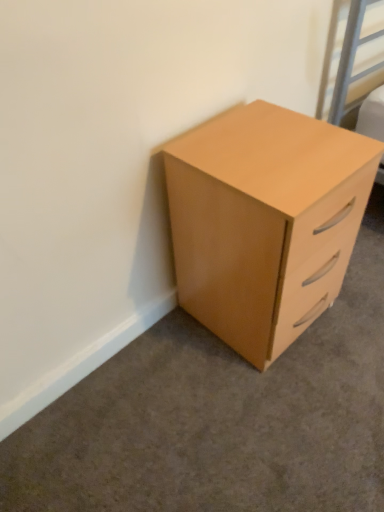
The image size is (384, 512). I want to click on free space in front of light brown wood chest of drawers at lower right, so click(x=268, y=411).